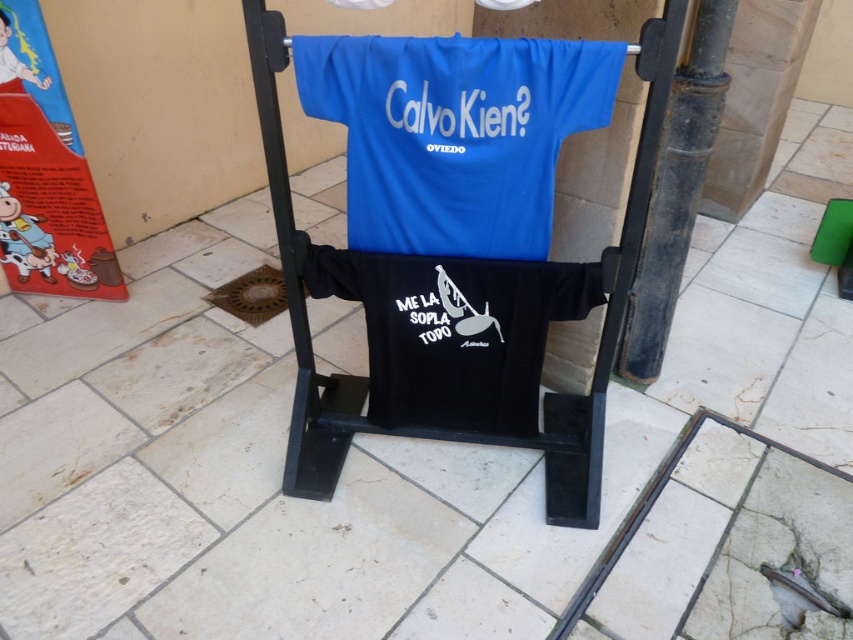
Question: Which point appears farthest from the camera in this image?

Choices:
 (A) (413, 118)
 (B) (445, 412)

Answer: (B)

Question: Which is nearer to the black matte t-shirt at center?

Choices:
 (A) metallic black folding chair at center
 (B) black matte pole at center
 (C) blue fabric t-shirt at center

Answer: (A)

Question: Considering the relative positions of black matte t-shirt at center and metallic black folding chair at center in the image provided, where is black matte t-shirt at center located with respect to metallic black folding chair at center?

Choices:
 (A) left
 (B) right

Answer: (A)

Question: Is blue fabric t-shirt at center wider than black matte t-shirt at center?

Choices:
 (A) no
 (B) yes

Answer: (A)

Question: Which point is farther to the camera?

Choices:
 (A) metallic black folding chair at center
 (B) blue fabric t-shirt at center
 (C) black matte pole at center

Answer: (C)

Question: Is black matte t-shirt at center above metallic black folding chair at center?

Choices:
 (A) yes
 (B) no

Answer: (B)